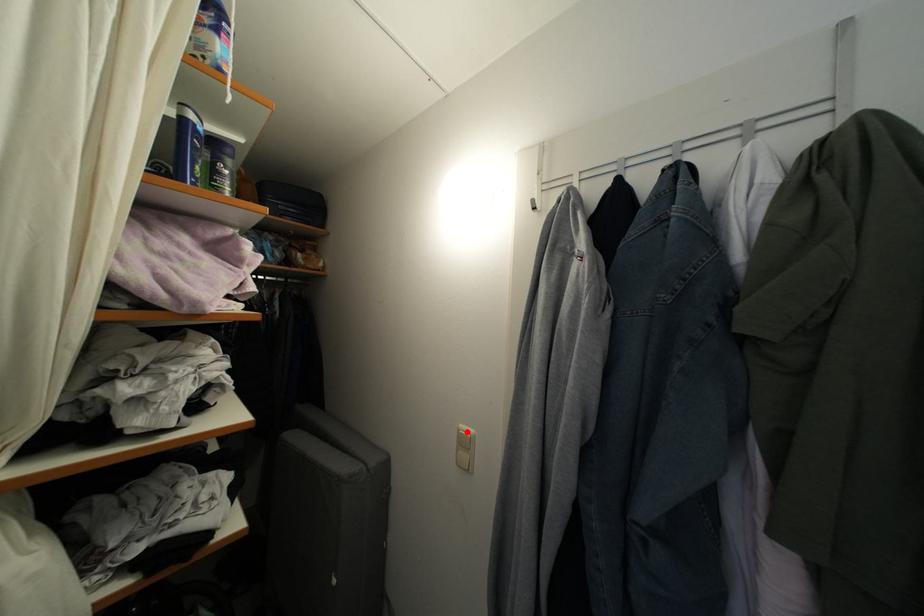
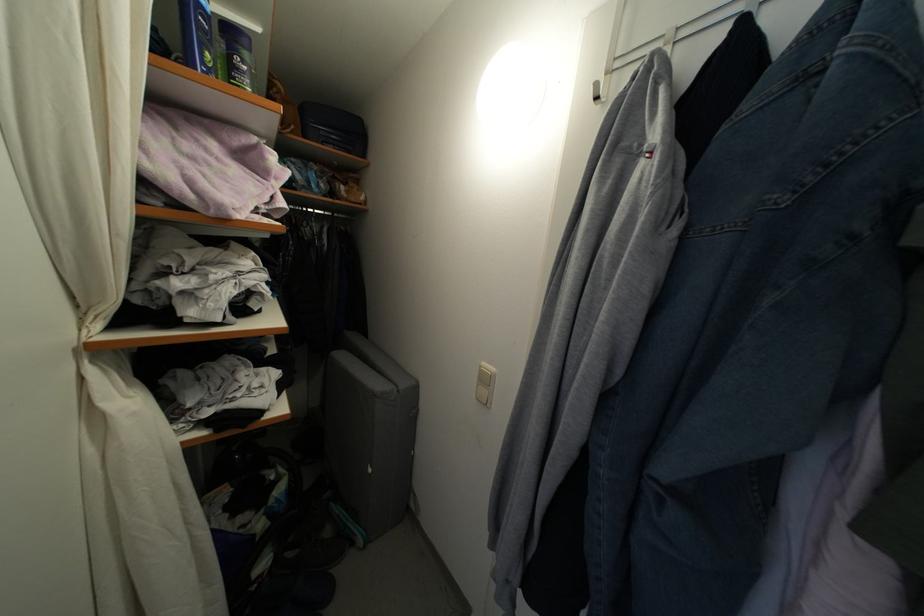
Find the pixel in the second image that matches the highlighted location in the first image.

(489, 370)